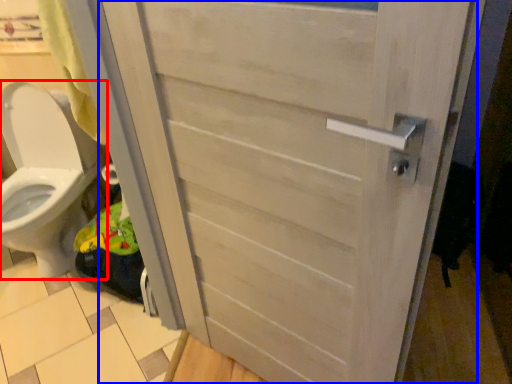
Question: Which of the following is the closest to the observer, toilet (highlighted by a red box) or door (highlighted by a blue box)?

Choices:
 (A) toilet
 (B) door

Answer: (B)